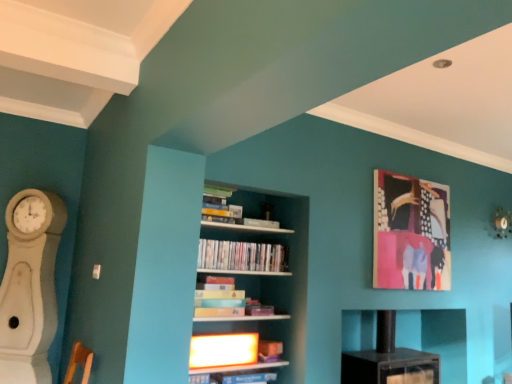
The width and height of the screenshot is (512, 384). In order to click on blank space situated above abstract painting at upper right (from a real-world perspective) in this screenshot , I will do `click(409, 177)`.